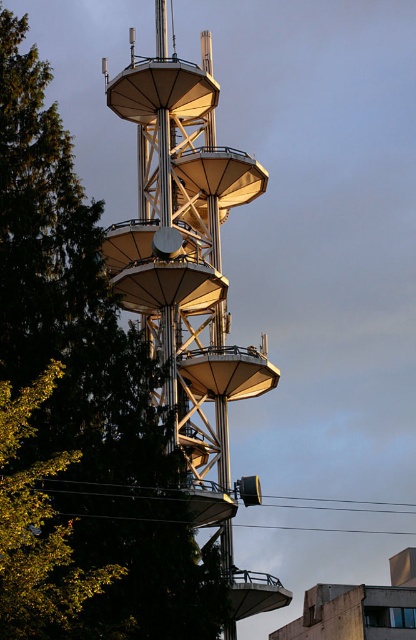
Question: Is green leafy tree at left further to camera compared to metallic silver tower at center?

Choices:
 (A) yes
 (B) no

Answer: (B)

Question: Considering the relative positions of green leafy tree at left and metallic silver tower at center in the image provided, where is green leafy tree at left located with respect to metallic silver tower at center?

Choices:
 (A) right
 (B) left

Answer: (B)

Question: Which object appears farthest from the camera in this image?

Choices:
 (A) metallic silver tower at center
 (B) green leafy tree at left

Answer: (A)

Question: Considering the relative positions of green leafy tree at left and metallic silver tower at center in the image provided, where is green leafy tree at left located with respect to metallic silver tower at center?

Choices:
 (A) below
 (B) above

Answer: (A)

Question: Which point appears closest to the camera in this image?

Choices:
 (A) (175, 109)
 (B) (81, 467)

Answer: (B)